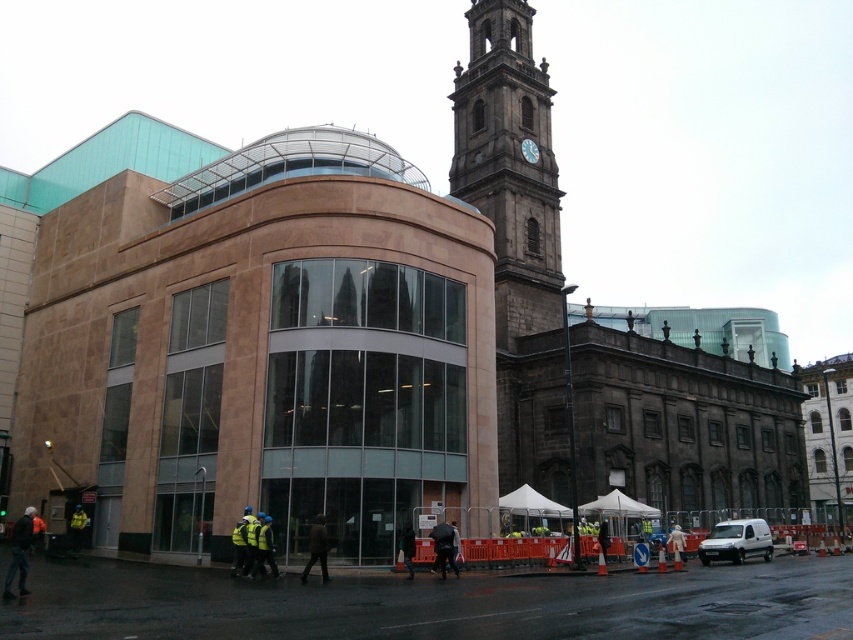
Question: Which point is closer to the camera?

Choices:
 (A) yellow reflective vest at lower center
 (B) stone clock tower at center
 (C) yellow reflective vest at center

Answer: (A)

Question: Observing the image, what is the correct spatial positioning of stone clock tower at center in reference to dark gray jacket at lower left?

Choices:
 (A) above
 (B) below

Answer: (A)

Question: Which point is farther to the camera?

Choices:
 (A) white matte jacket at center
 (B) yellow reflective vest at center
 (C) yellow reflective vest at lower center
 (D) stone clock tower at center

Answer: (D)

Question: Based on their relative distances, which object is farther from the dark green jacket at center?

Choices:
 (A) white matte jacket at center
 (B) dark gray jacket at lower left
 (C) yellow reflective vest at center
 (D) yellow reflective vest at lower center

Answer: (C)

Question: Is dark gray jacket at lower left bigger than yellow reflective vest at lower center?

Choices:
 (A) yes
 (B) no

Answer: (A)

Question: Does dark brown leather jacket at center appear on the right side of dark blue jacket at center?

Choices:
 (A) no
 (B) yes

Answer: (A)